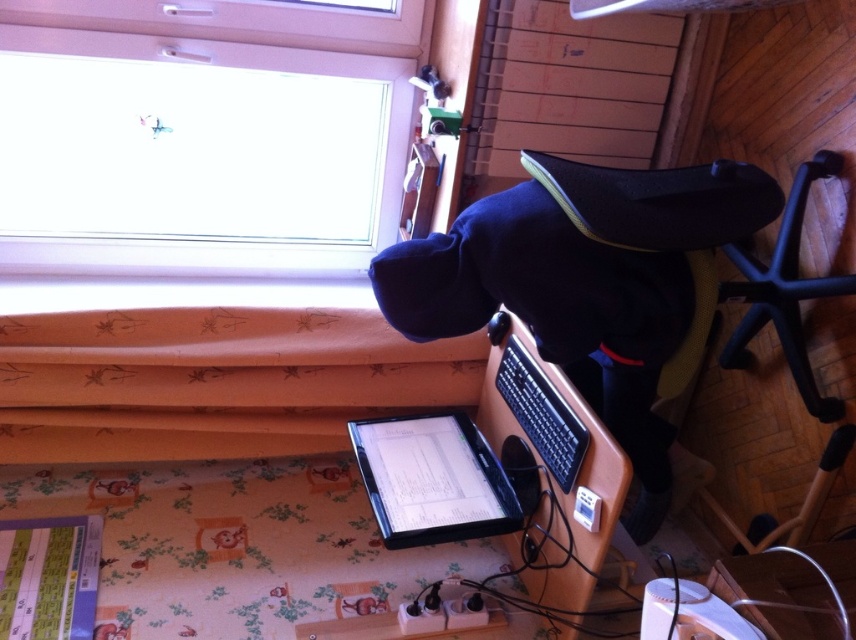
Can you confirm if black fleece jacket at center is shorter than satin black laptop at center?

No, black fleece jacket at center is not shorter than satin black laptop at center.

Which is in front, point (584, 340) or point (402, 504)?

Point (584, 340) is more forward.

Where is `black fleece jacket at center`? black fleece jacket at center is located at coordinates (559, 317).

Looking at this image, can you confirm if satin black laptop at center is wider than black matte laptop at center?

Yes, satin black laptop at center is wider than black matte laptop at center.

Between satin black laptop at center and black matte laptop at center, which one is positioned higher?

Positioned higher is black matte laptop at center.

Describe the element at coordinates (432, 480) in the screenshot. I see `satin black laptop at center` at that location.

I want to click on satin black laptop at center, so click(x=432, y=480).

Does transparent glass window at upper left appear under black matte laptop at center?

Actually, transparent glass window at upper left is above black matte laptop at center.

Who is positioned more to the left, transparent glass window at upper left or black matte laptop at center?

transparent glass window at upper left is more to the left.

Does point (52, 216) lie in front of point (544, 410)?

No.

The height and width of the screenshot is (640, 856). In order to click on transparent glass window at upper left in this screenshot , I will do `click(201, 134)`.